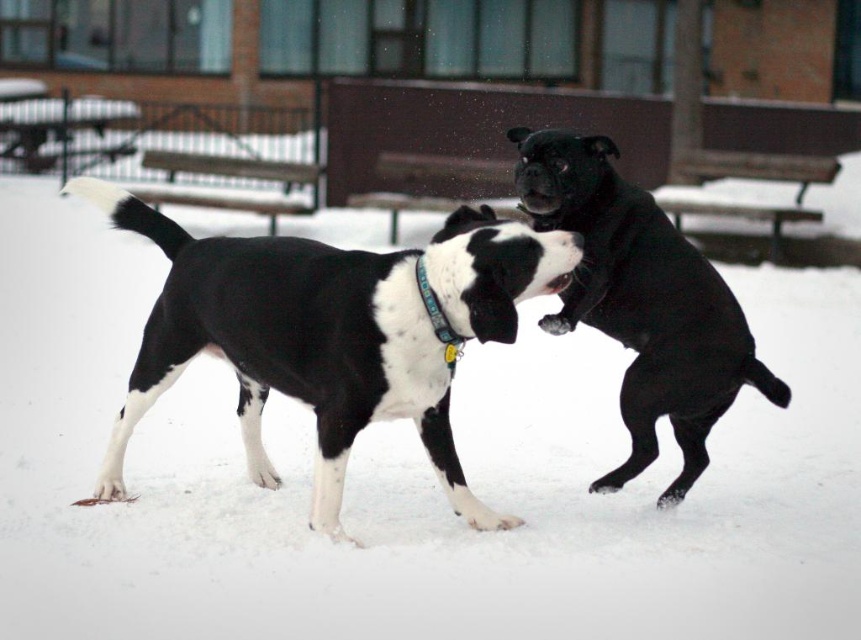
Question: Does black and white fur dog at center have a greater width compared to teal fabric neckband at center?

Choices:
 (A) yes
 (B) no

Answer: (A)

Question: Observing the image, what is the correct spatial positioning of black and white fur dog at center in reference to black glossy dog at center?

Choices:
 (A) right
 (B) left

Answer: (B)

Question: Does black glossy dog at center have a smaller size compared to teal fabric neckband at center?

Choices:
 (A) yes
 (B) no

Answer: (B)

Question: Among these points, which one is nearest to the camera?

Choices:
 (A) (456, 339)
 (B) (461, 513)

Answer: (A)

Question: Considering the real-world distances, which object is closest to the teal fabric neckband at center?

Choices:
 (A) black and white fur dog at center
 (B) black glossy dog at center

Answer: (A)

Question: Which point is closer to the camera taking this photo?

Choices:
 (A) (549, 180)
 (B) (269, 237)
 (C) (446, 339)

Answer: (C)